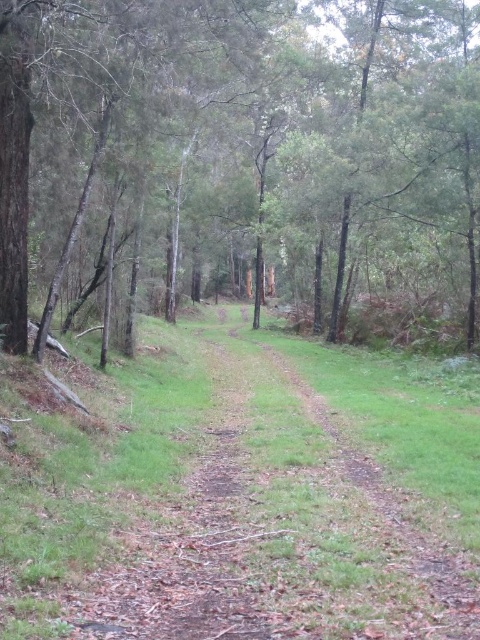
Can you confirm if green matte tree at center is positioned to the left of brown dirt track at center?

No, green matte tree at center is not to the left of brown dirt track at center.

Does green matte tree at center have a larger size compared to brown dirt track at center?

Yes, green matte tree at center is bigger than brown dirt track at center.

Image resolution: width=480 pixels, height=640 pixels. I want to click on green matte tree at center, so click(x=245, y=157).